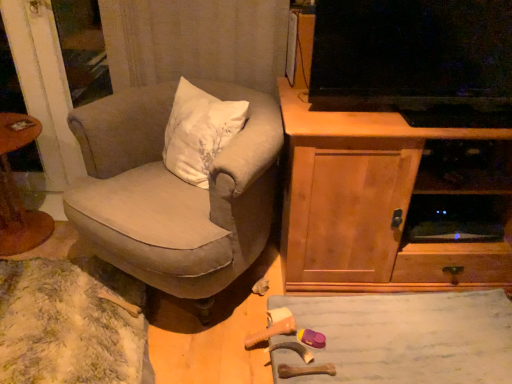
Question: Would you say wooden cabinet at right is part of wooden round table at left's contents?

Choices:
 (A) yes
 (B) no

Answer: (B)

Question: Is wooden round table at left not near wooden cabinet at right?

Choices:
 (A) yes
 (B) no

Answer: (A)

Question: Is wooden round table at left shorter than wooden cabinet at right?

Choices:
 (A) no
 (B) yes

Answer: (B)

Question: Can you confirm if wooden round table at left is thinner than wooden cabinet at right?

Choices:
 (A) yes
 (B) no

Answer: (A)

Question: Is wooden round table at left at the right side of wooden cabinet at right?

Choices:
 (A) yes
 (B) no

Answer: (B)

Question: From their relative heights in the image, would you say wooden cabinet at right is taller or shorter than wooden toy at lower center?

Choices:
 (A) tall
 (B) short

Answer: (A)

Question: Considering the relative positions of wooden cabinet at right and wooden toy at lower center in the image provided, is wooden cabinet at right to the left or to the right of wooden toy at lower center?

Choices:
 (A) right
 (B) left

Answer: (A)

Question: Is point (292, 228) positioned closer to the camera than point (472, 344)?

Choices:
 (A) farther
 (B) closer

Answer: (A)

Question: Choose the correct answer: Is wooden cabinet at right inside wooden toy at lower center or outside it?

Choices:
 (A) outside
 (B) inside

Answer: (A)

Question: Choose the correct answer: Is wooden toy at lower center inside wooden cabinet at right or outside it?

Choices:
 (A) inside
 (B) outside

Answer: (B)

Question: From a real-world perspective, is wooden toy at lower center positioned above or below wooden cabinet at right?

Choices:
 (A) above
 (B) below

Answer: (B)

Question: Considering the positions of point (501, 304) and point (425, 273), is point (501, 304) closer or farther from the camera than point (425, 273)?

Choices:
 (A) farther
 (B) closer

Answer: (B)

Question: Is wooden toy at lower center wider or thinner than wooden cabinet at right?

Choices:
 (A) wide
 (B) thin

Answer: (B)

Question: From a real-world perspective, is wooden toy at lower center positioned above or below beige fabric chair at center?

Choices:
 (A) below
 (B) above

Answer: (A)

Question: Would you say wooden toy at lower center is inside or outside beige fabric chair at center?

Choices:
 (A) outside
 (B) inside

Answer: (A)